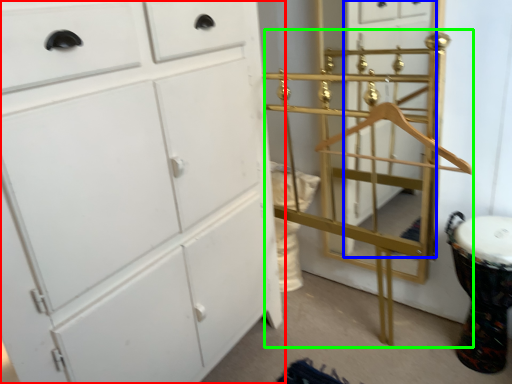
Question: Based on their relative distances, which object is farther from chest of drawers (highlighted by a red box)? Choose from glass door (highlighted by a blue box) and bunk bed (highlighted by a green box).

Choices:
 (A) glass door
 (B) bunk bed

Answer: (A)